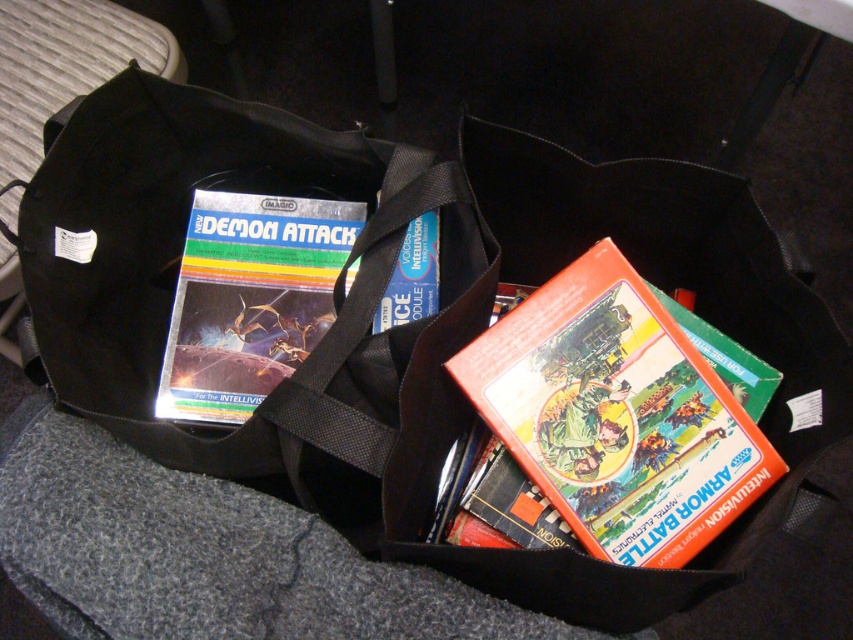
You are organizing a retro gaming event and need to locate the orange matte game cartridge at center. According to the image, what are the coordinates where you should look?

The orange matte game cartridge at center is located at point coordinates (616, 413).